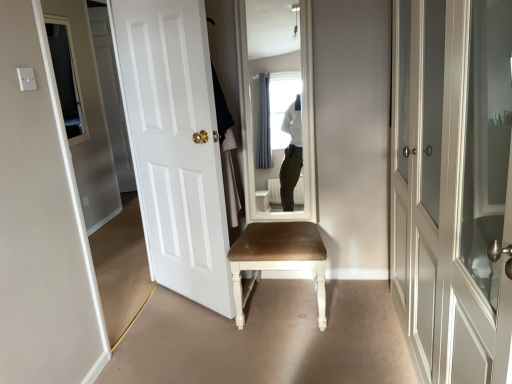
Question: Is matte gray wardrobe at right, which is the 3th door in left-to-right order, taller than white painted wood door at center, the 2th door from the left?

Choices:
 (A) yes
 (B) no

Answer: (B)

Question: Is matte gray wardrobe at right, the first door viewed from the right, positioned beyond the bounds of white painted wood door at center, which appears as the second door when viewed from the right?

Choices:
 (A) yes
 (B) no

Answer: (A)

Question: From the image's perspective, is matte gray wardrobe at right, the first door viewed from the right, beneath white painted wood door at center, the 2th door from the left?

Choices:
 (A) yes
 (B) no

Answer: (A)

Question: Could you tell me if matte gray wardrobe at right, which is the 3th door in left-to-right order, is turned towards white painted wood door at center, the 2th door from the left?

Choices:
 (A) no
 (B) yes

Answer: (B)

Question: From a real-world perspective, is matte gray wardrobe at right, which is the 3th door in left-to-right order, under white painted wood door at center, which appears as the second door when viewed from the right?

Choices:
 (A) no
 (B) yes

Answer: (B)

Question: Can you confirm if matte gray wardrobe at right, which is the 3th door in left-to-right order, is bigger than white painted wood door at center, the 2th door from the left?

Choices:
 (A) no
 (B) yes

Answer: (B)

Question: Is white matte door at left, arranged as the third door when viewed from the right, closer to the viewer compared to matte gray wardrobe at right, which is the 3th door in left-to-right order?

Choices:
 (A) yes
 (B) no

Answer: (B)

Question: Does white matte door at left, arranged as the third door when viewed from the right, have a smaller size compared to matte gray wardrobe at right, which is the 3th door in left-to-right order?

Choices:
 (A) yes
 (B) no

Answer: (A)

Question: Is white matte door at left, arranged as the third door when viewed from the right, not close to matte gray wardrobe at right, the first door viewed from the right?

Choices:
 (A) no
 (B) yes

Answer: (B)

Question: Considering the relative sizes of white matte door at left, acting as the 1th door starting from the left, and matte gray wardrobe at right, the first door viewed from the right, in the image provided, is white matte door at left, acting as the 1th door starting from the left, taller than matte gray wardrobe at right, the first door viewed from the right,?

Choices:
 (A) yes
 (B) no

Answer: (A)

Question: Considering the relative sizes of white matte door at left, arranged as the third door when viewed from the right, and matte gray wardrobe at right, the first door viewed from the right, in the image provided, is white matte door at left, arranged as the third door when viewed from the right, shorter than matte gray wardrobe at right, the first door viewed from the right,?

Choices:
 (A) no
 (B) yes

Answer: (A)

Question: Would you say white matte door at left, acting as the 1th door starting from the left, is outside matte gray wardrobe at right, which is the 3th door in left-to-right order?

Choices:
 (A) yes
 (B) no

Answer: (A)

Question: Does white painted wood door at center, the 2th door from the left, have a smaller size compared to white cotton robe at center?

Choices:
 (A) yes
 (B) no

Answer: (B)